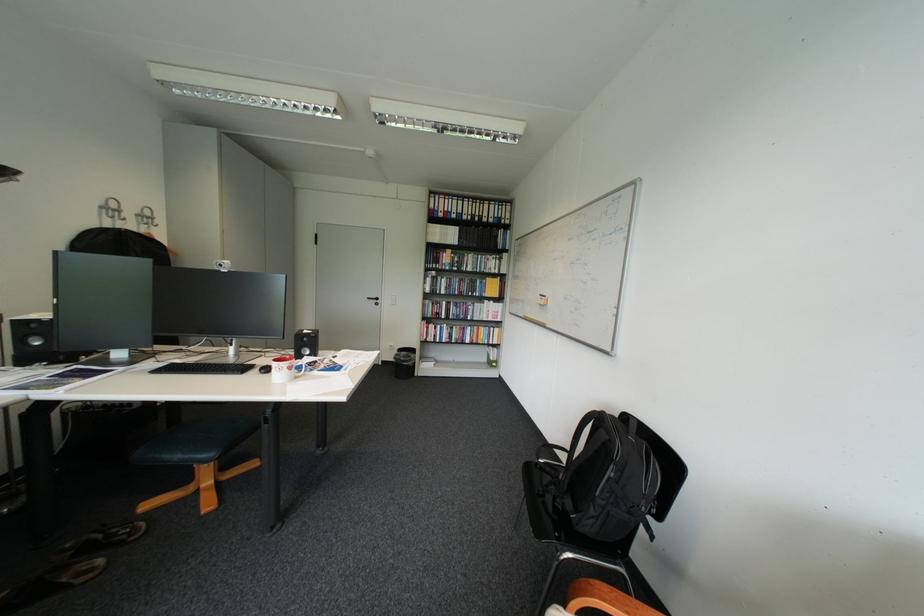
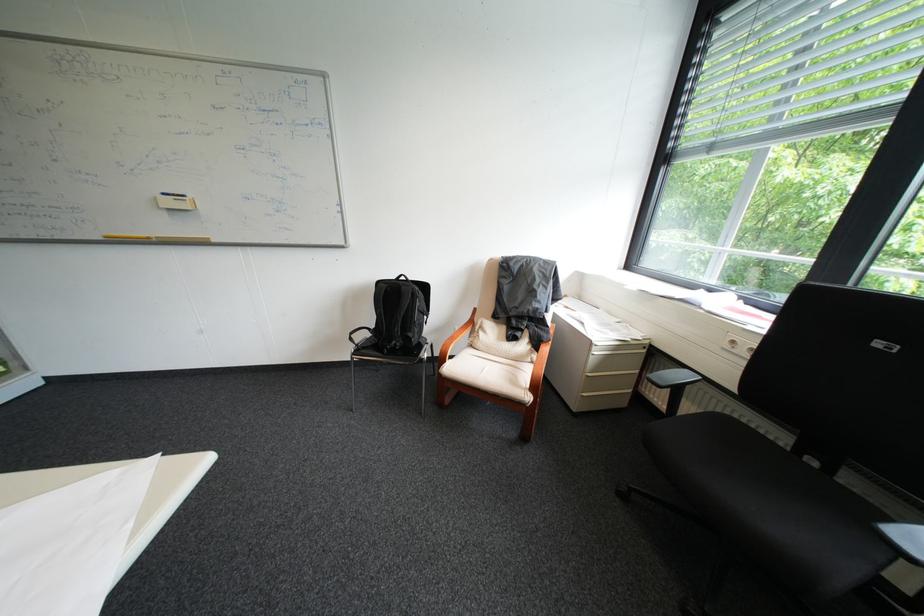
The point at (572,557) is marked in the first image. Where is the corresponding point in the second image?

(436, 358)